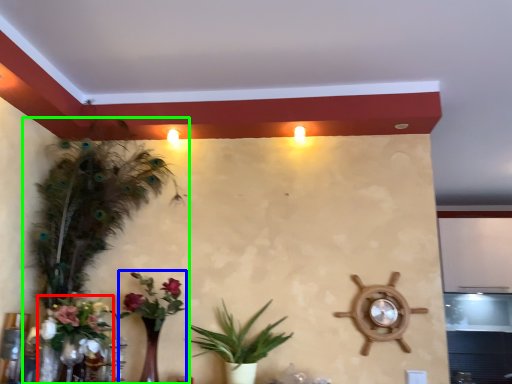
Question: Which object is positioned closest to floral arrangement (highlighted by a red box)? Select from floral arrangement (highlighted by a blue box) and houseplant (highlighted by a green box).

Choices:
 (A) floral arrangement
 (B) houseplant

Answer: (B)